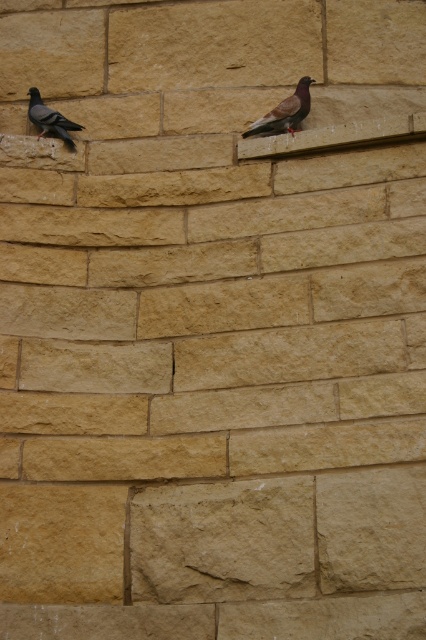
Between matte gray pigeon at upper center and matte black pigeon at left, which one has more height?

Standing taller between the two is matte black pigeon at left.

Which is more to the right, matte gray pigeon at upper center or matte black pigeon at left?

matte gray pigeon at upper center is more to the right.

Measure the distance between point (x=302, y=81) and camera.

They are 11.59 meters apart.

You are a GUI agent. You are given a task and a screenshot of the screen. Output one action in this format:
    pyautogui.click(x=<x>, y=<y>)
    Task: Click on the matte gray pigeon at upper center
    This screenshot has height=640, width=426.
    Given the screenshot: What is the action you would take?
    pyautogui.click(x=284, y=112)